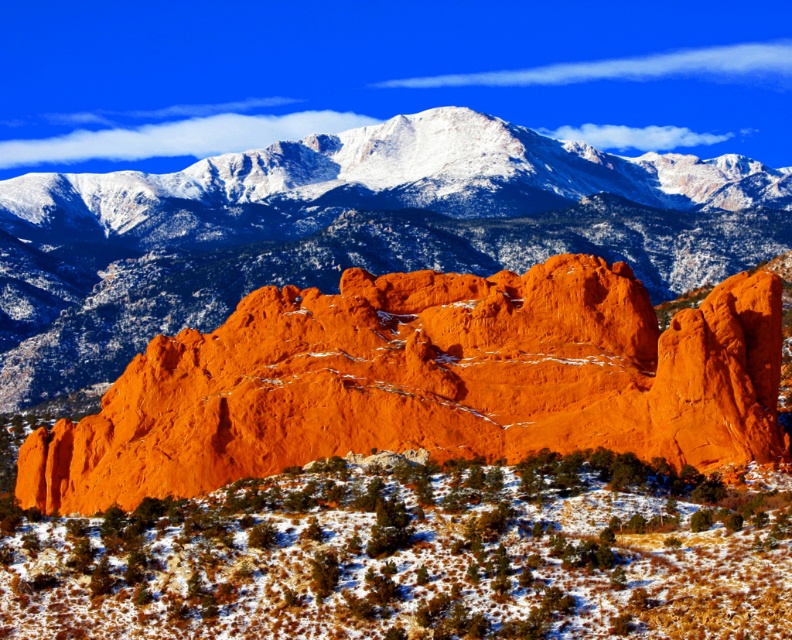
Question: Is matte orange rock at center thinner than orange rock formation at center?

Choices:
 (A) yes
 (B) no

Answer: (A)

Question: Can you confirm if matte orange rock at center is positioned above orange rock formation at center?

Choices:
 (A) yes
 (B) no

Answer: (B)

Question: Which of the following is the farthest from the observer?

Choices:
 (A) orange rock formation at center
 (B) matte orange rock at center

Answer: (A)

Question: Does matte orange rock at center appear on the right side of orange rock formation at center?

Choices:
 (A) no
 (B) yes

Answer: (B)

Question: Among these objects, which one is farthest from the camera?

Choices:
 (A) orange rock formation at center
 (B) matte orange rock at center

Answer: (A)